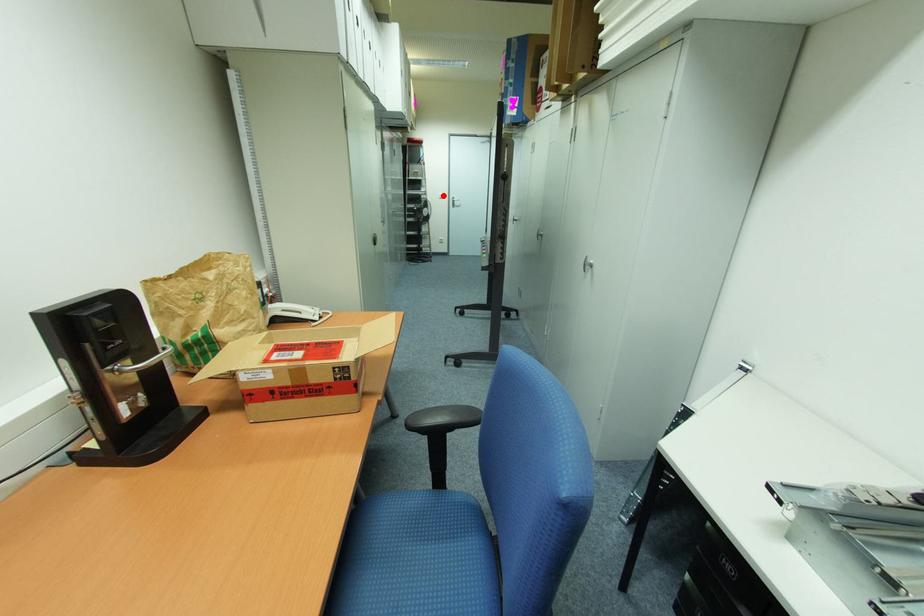
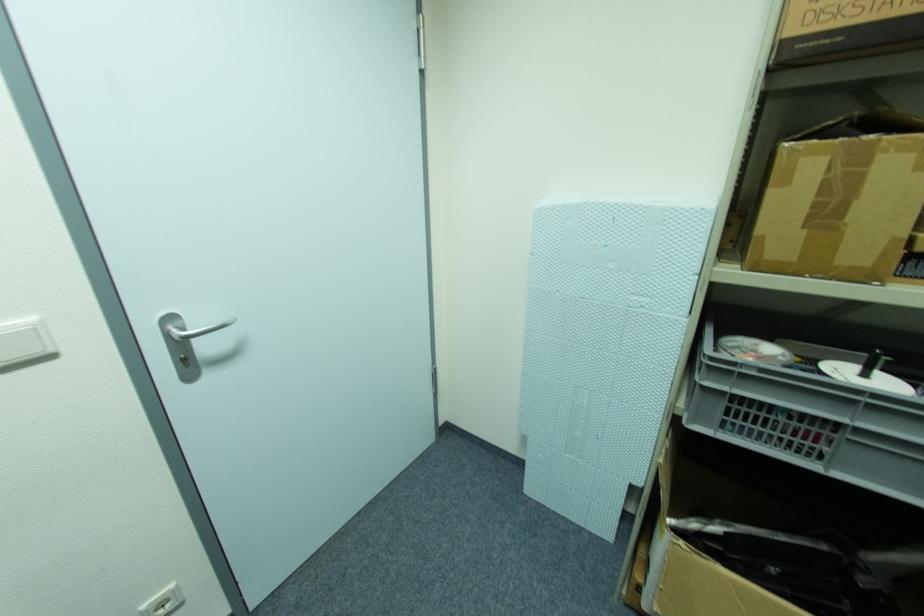
Where in the second image is the point corresponding to the highlighted location from the first image?

(34, 331)